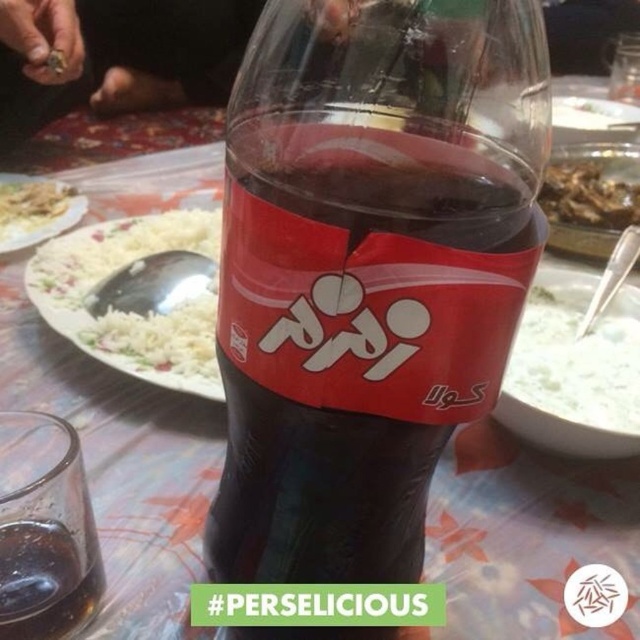
Between white creamy yogurt at center and brown crispy fried food at center, which one appears on the left side from the viewer's perspective?

white creamy yogurt at center

I want to click on white creamy yogurt at center, so click(x=577, y=360).

Who is more distant from viewer, (x=616, y=364) or (x=560, y=216)?

The point (x=560, y=216) is behind.

Identify the location of white creamy yogurt at center. (577, 360).

Can you confirm if white rice at center is wider than transparent glass at lower left?

Correct, the width of white rice at center exceeds that of transparent glass at lower left.

In the scene shown: Who is positioned more to the right, white rice at center or transparent glass at lower left?

transparent glass at lower left

This screenshot has width=640, height=640. What do you see at coordinates (128, 314) in the screenshot?
I see `white rice at center` at bounding box center [128, 314].

Image resolution: width=640 pixels, height=640 pixels. I want to click on white rice at center, so click(128, 314).

In the scene shown: Is white rice at center behind brown crispy fried food at center?

No, it is not.

This screenshot has height=640, width=640. Find the location of `white rice at center`. white rice at center is located at coordinates (128, 314).